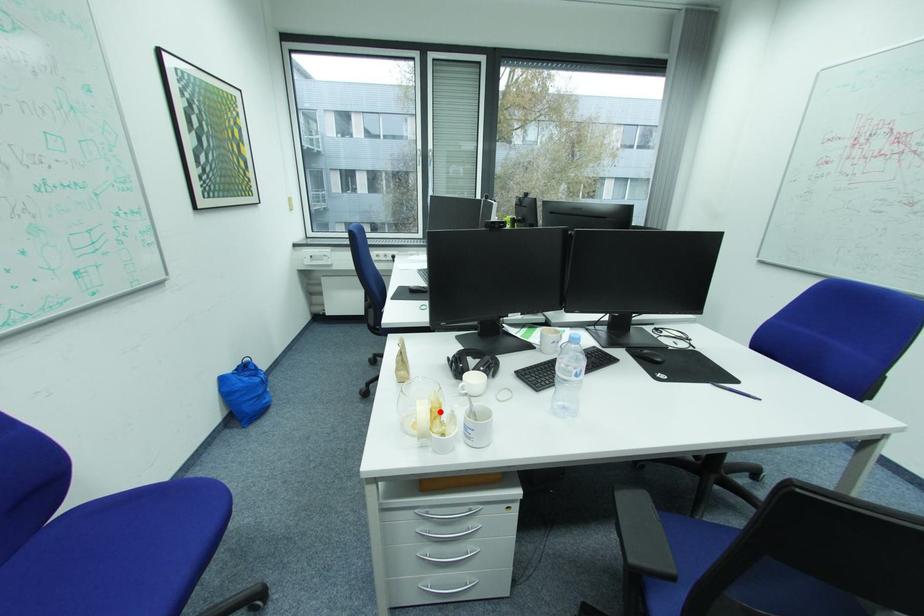
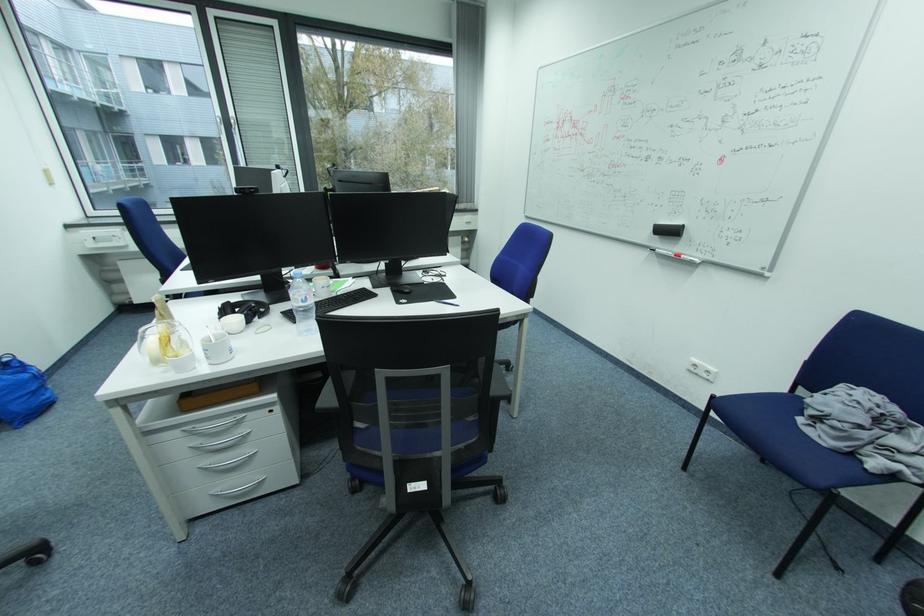
Locate, in the second image, the point that corresponds to the highlighted location in the first image.

(169, 339)